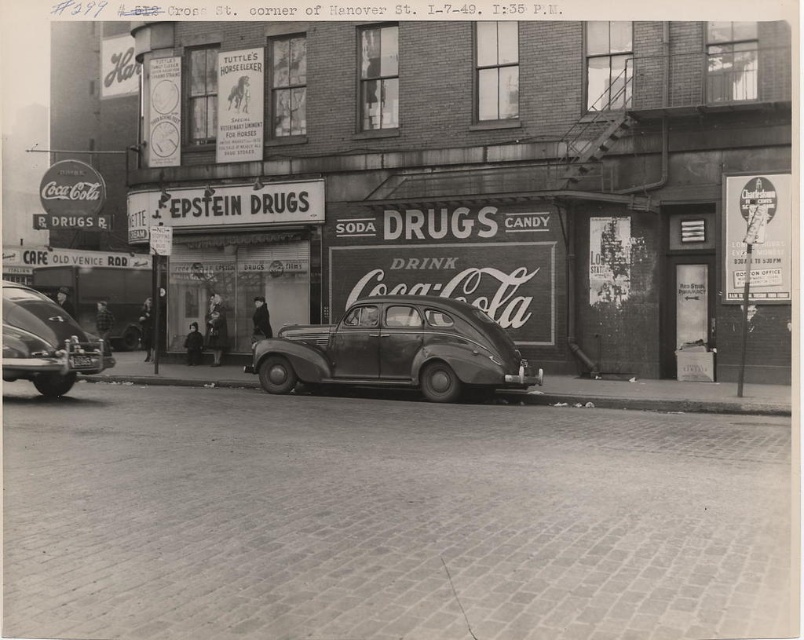
Which is in front, point (269, 353) or point (40, 364)?

Point (40, 364)

Locate an element on the screen. The width and height of the screenshot is (804, 640). shiny dark gray car at center is located at coordinates (396, 349).